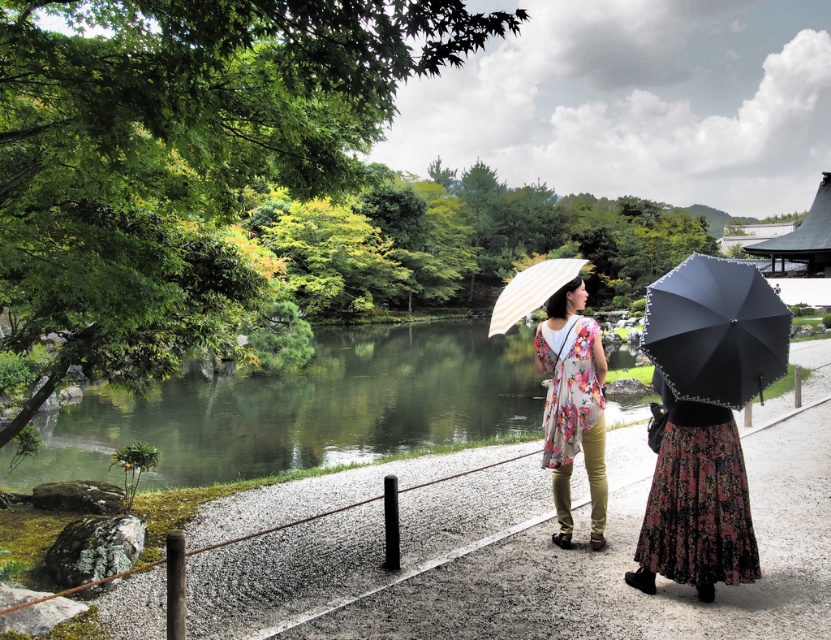
Question: Is floral-patterned skirt at center positioned before matte black umbrella at right?

Choices:
 (A) yes
 (B) no

Answer: (B)

Question: Is green smooth water at center bigger than white striped fabric umbrella at center?

Choices:
 (A) no
 (B) yes

Answer: (B)

Question: Considering the relative positions of matte black umbrella at right and floral fabric dress at center in the image provided, where is matte black umbrella at right located with respect to floral fabric dress at center?

Choices:
 (A) above
 (B) below

Answer: (A)

Question: Which object appears farthest from the camera in this image?

Choices:
 (A) matte black umbrella at right
 (B) white striped fabric umbrella at center
 (C) floral-patterned skirt at center

Answer: (B)

Question: Which object is closer to the camera taking this photo?

Choices:
 (A) white striped fabric umbrella at center
 (B) matte black umbrella at right

Answer: (B)

Question: Which object is closer to the camera taking this photo?

Choices:
 (A) floral-patterned skirt at center
 (B) matte black umbrella at right

Answer: (B)